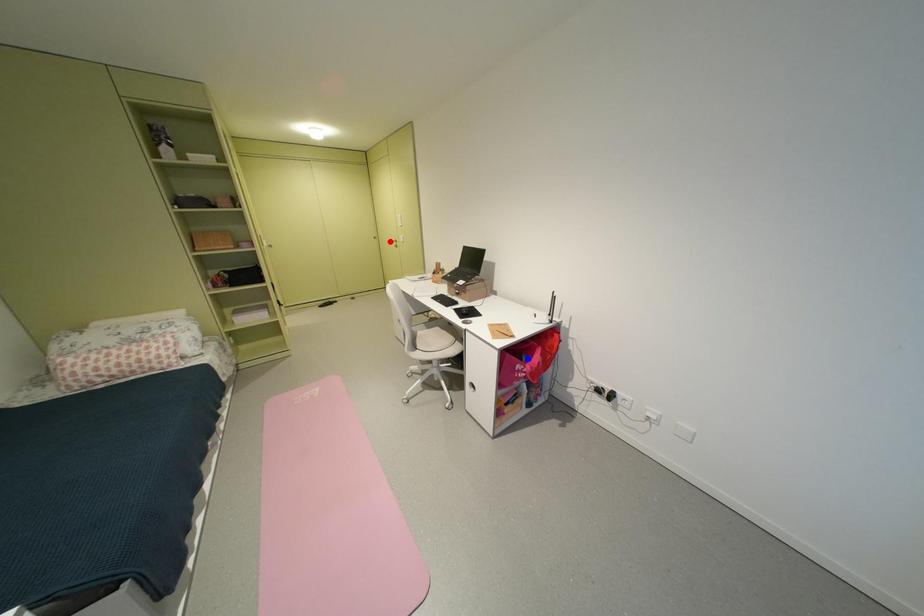
Question: In the image, two points are highlighted. Which point is nearer to the camera? Reply with the corresponding letter.

Choices:
 (A) blue point
 (B) red point

Answer: (A)